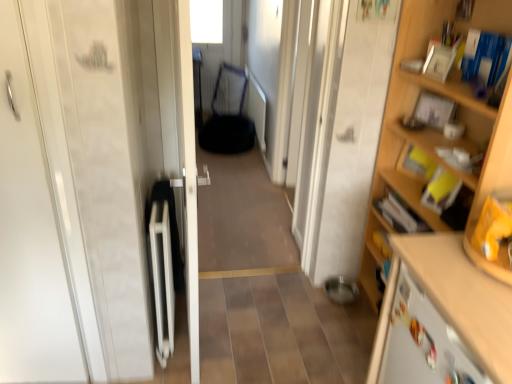
Question: Considering the relative positions of wooden shelf at right and white glossy door at center, positioned as the second door in left-to-right order, in the image provided, is wooden shelf at right to the left of white glossy door at center, positioned as the second door in left-to-right order, from the viewer's perspective?

Choices:
 (A) no
 (B) yes

Answer: (A)

Question: Does wooden shelf at right have a smaller size compared to white glossy door at center, positioned as the second door in left-to-right order?

Choices:
 (A) yes
 (B) no

Answer: (B)

Question: Is wooden shelf at right turned away from white glossy door at center, positioned as the second door in left-to-right order?

Choices:
 (A) no
 (B) yes

Answer: (A)

Question: Can you confirm if wooden shelf at right is thinner than white glossy door at center, which is the first door in right-to-left order?

Choices:
 (A) no
 (B) yes

Answer: (A)

Question: Does wooden shelf at right touch white glossy door at center, positioned as the second door in left-to-right order?

Choices:
 (A) no
 (B) yes

Answer: (A)

Question: From the image's perspective, is wooden shelf at right on white glossy door at center, which is the first door in right-to-left order?

Choices:
 (A) no
 (B) yes

Answer: (A)

Question: Could you tell me if metallic mesh armchair at center is turned towards wooden cabinet at lower right?

Choices:
 (A) yes
 (B) no

Answer: (B)

Question: Is metallic mesh armchair at center not inside wooden cabinet at lower right?

Choices:
 (A) yes
 (B) no

Answer: (A)

Question: Is metallic mesh armchair at center further to camera compared to wooden cabinet at lower right?

Choices:
 (A) no
 (B) yes

Answer: (B)

Question: Can you confirm if metallic mesh armchair at center is bigger than wooden cabinet at lower right?

Choices:
 (A) yes
 (B) no

Answer: (B)

Question: From a real-world perspective, is metallic mesh armchair at center located higher than wooden cabinet at lower right?

Choices:
 (A) yes
 (B) no

Answer: (B)

Question: From the image's perspective, does metallic mesh armchair at center appear higher than wooden cabinet at lower right?

Choices:
 (A) yes
 (B) no

Answer: (A)

Question: Is wooden cabinet at lower right shorter than wooden shelf at right?

Choices:
 (A) no
 (B) yes

Answer: (B)